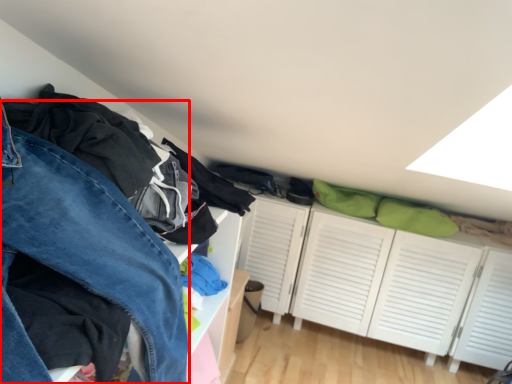
Question: Where is trousers (annotated by the red box) located in relation to dresser in the image?

Choices:
 (A) left
 (B) right

Answer: (A)